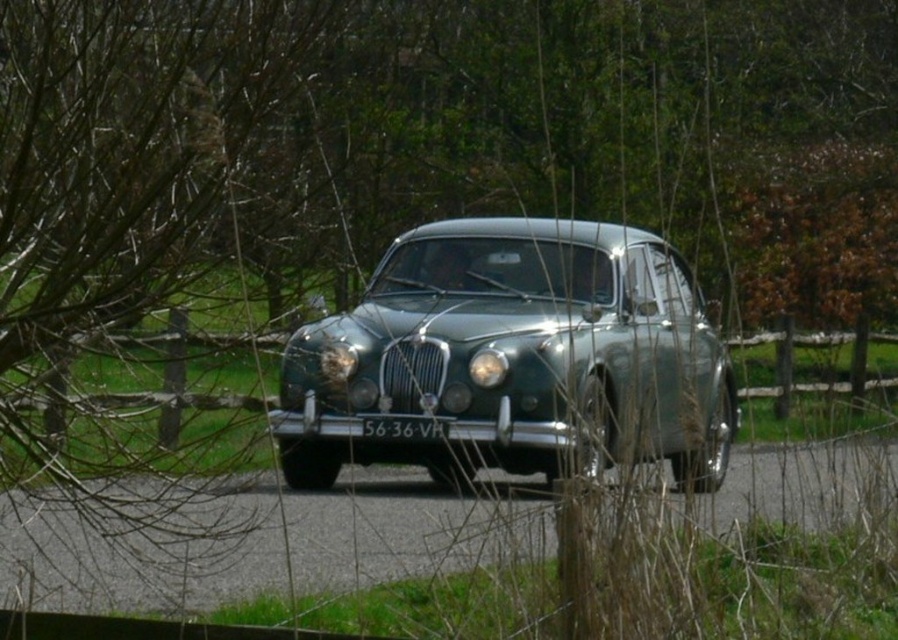
Question: Which object is positioned farthest from the matte silver headlight at center?

Choices:
 (A) metallic green car at center
 (B) white plastic license plate at center

Answer: (A)

Question: Can you confirm if metallic green car at center is wider than white plastic license plate at center?

Choices:
 (A) no
 (B) yes

Answer: (A)

Question: Estimate the real-world distances between objects in this image. Which object is farther from the matte silver headlight at center?

Choices:
 (A) metallic green car at center
 (B) white plastic license plate at center

Answer: (A)

Question: Which object appears closest to the camera in this image?

Choices:
 (A) matte silver headlight at center
 (B) metallic green car at center

Answer: (A)

Question: Is white plastic license plate at center further to camera compared to matte silver headlight at center?

Choices:
 (A) no
 (B) yes

Answer: (A)

Question: Is white plastic license plate at center further to camera compared to matte silver headlight at center?

Choices:
 (A) yes
 (B) no

Answer: (B)